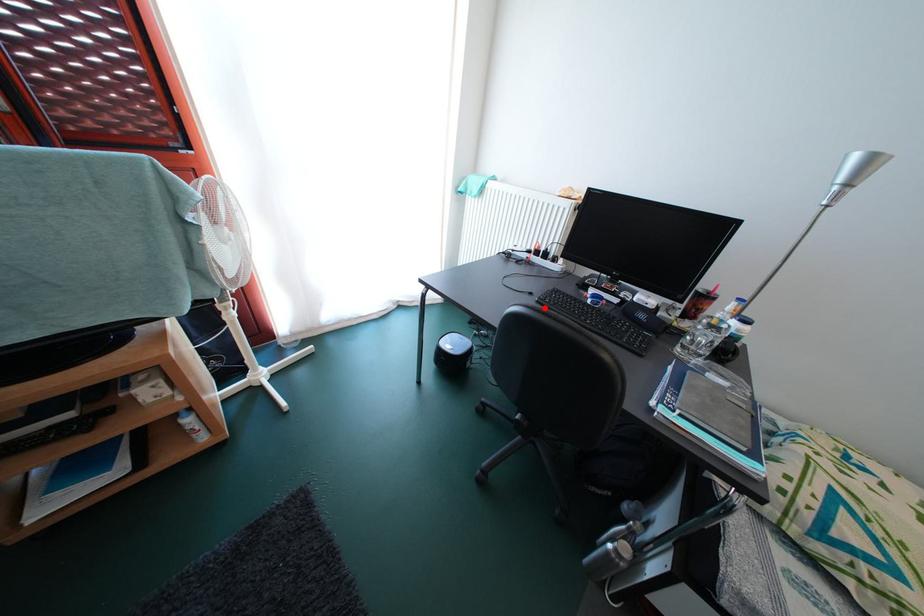
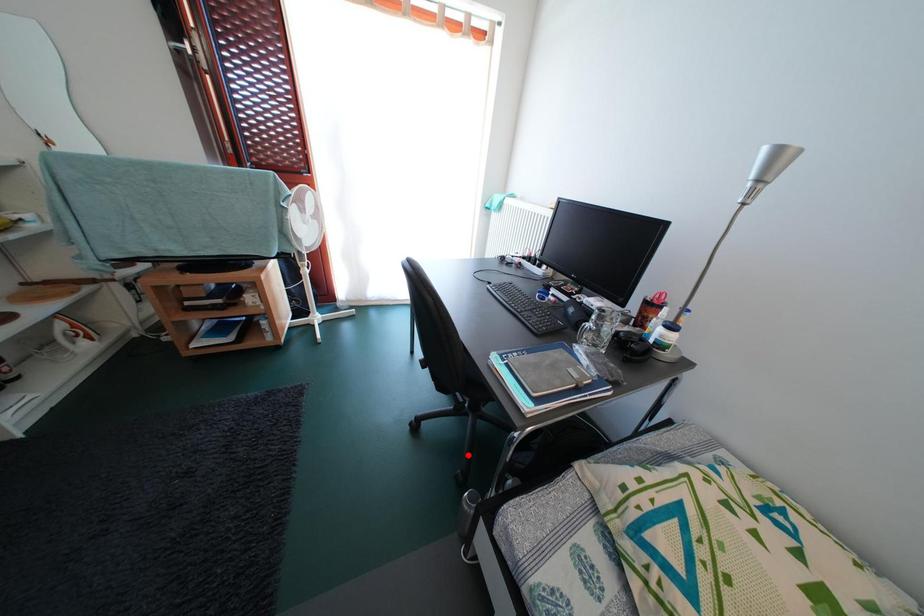
I am providing you with two images of the same scene from different viewpoints. A red point is marked on the first image and another point is marked on the second image. Are the points marked in image1 and image2 representing the same 3D position?

No